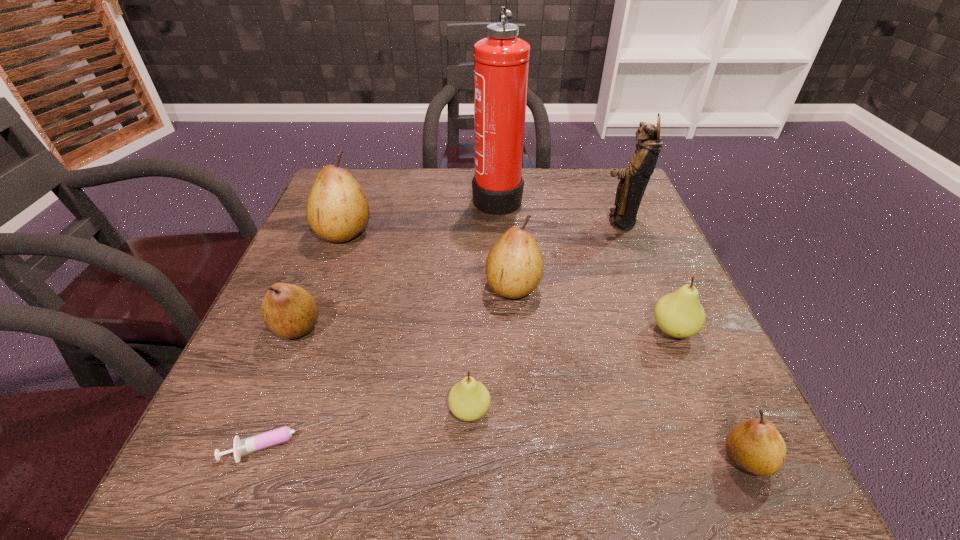
Locate an element on the screen. Image resolution: width=960 pixels, height=540 pixels. the fifth farthest pear is located at coordinates (469, 400).

Locate an element on the screen. The width and height of the screenshot is (960, 540). the smaller green pear is located at coordinates (469, 400).

Identify the location of the smallest brown pear. (755, 445).

Where is `the nearest brown pear`? Image resolution: width=960 pixels, height=540 pixels. the nearest brown pear is located at coordinates (755, 445).

Where is `syringe`? syringe is located at coordinates (280, 435).

This screenshot has height=540, width=960. I want to click on white syringe, so click(280, 435).

Find the location of `vacant region located on the front-facing side of the red fire extinguisher`. vacant region located on the front-facing side of the red fire extinguisher is located at coordinates (446, 197).

You are a GUI agent. You are given a task and a screenshot of the screen. Output one action in this format:
    pyautogui.click(x=<x>, y=<y>)
    Task: Click on the vacant space located 0.070m on the front-facing side of the red fire extinguisher
    
    Given the screenshot: What is the action you would take?
    pyautogui.click(x=446, y=197)

You are a GUI agent. You are given a task and a screenshot of the screen. Output one action in this format:
    pyautogui.click(x=<x>, y=<y>)
    Task: Click on the vacant space located on the front-facing side of the red fire extinguisher
    
    Given the screenshot: What is the action you would take?
    pyautogui.click(x=454, y=197)

In order to click on vacant space located on the front-facing side of the second tallest object in this screenshot , I will do `click(479, 221)`.